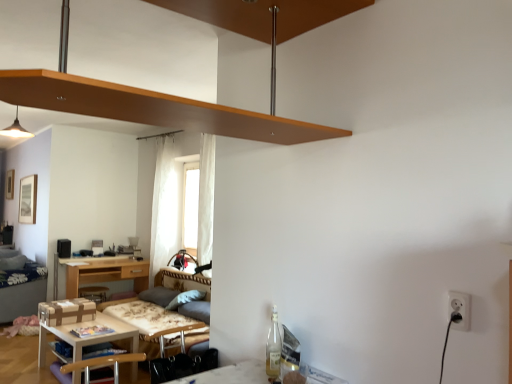
Question: Is matte white pendant light at upper left surrounding wooden table at lower left?

Choices:
 (A) no
 (B) yes

Answer: (A)

Question: Is matte white pendant light at upper left completely or partially outside of wooden table at lower left?

Choices:
 (A) yes
 (B) no

Answer: (A)

Question: Is matte white pendant light at upper left next to wooden table at lower left?

Choices:
 (A) no
 (B) yes

Answer: (A)

Question: Is matte white pendant light at upper left further to the viewer compared to wooden table at lower left?

Choices:
 (A) yes
 (B) no

Answer: (A)

Question: Could you tell me if matte white pendant light at upper left is facing wooden table at lower left?

Choices:
 (A) no
 (B) yes

Answer: (A)

Question: From a real-world perspective, is white plastic electric outlet at lower right above or below dark blue fabric bed at left?

Choices:
 (A) below
 (B) above

Answer: (B)

Question: Is point 455,322 closer or farther from the camera than point 38,286?

Choices:
 (A) closer
 (B) farther

Answer: (A)

Question: From the image's perspective, is white plastic electric outlet at lower right above or below dark blue fabric bed at left?

Choices:
 (A) below
 (B) above

Answer: (B)

Question: Is white plastic electric outlet at lower right situated inside dark blue fabric bed at left or outside?

Choices:
 (A) inside
 (B) outside

Answer: (B)

Question: Relative to white sheer curtain at center, is velvet grey couch at lower left in front or behind?

Choices:
 (A) behind
 (B) front

Answer: (B)

Question: From the image's perspective, is velvet grey couch at lower left above or below white sheer curtain at center?

Choices:
 (A) below
 (B) above

Answer: (A)

Question: From a real-world perspective, is velvet grey couch at lower left physically located above or below white sheer curtain at center?

Choices:
 (A) below
 (B) above

Answer: (A)

Question: Is velvet grey couch at lower left wider or thinner than white sheer curtain at center?

Choices:
 (A) thin
 (B) wide

Answer: (B)

Question: From the image's perspective, is white sheer curtain at center positioned above or below wooden table at lower left?

Choices:
 (A) above
 (B) below

Answer: (A)

Question: Is white sheer curtain at center situated inside wooden table at lower left or outside?

Choices:
 (A) outside
 (B) inside

Answer: (A)